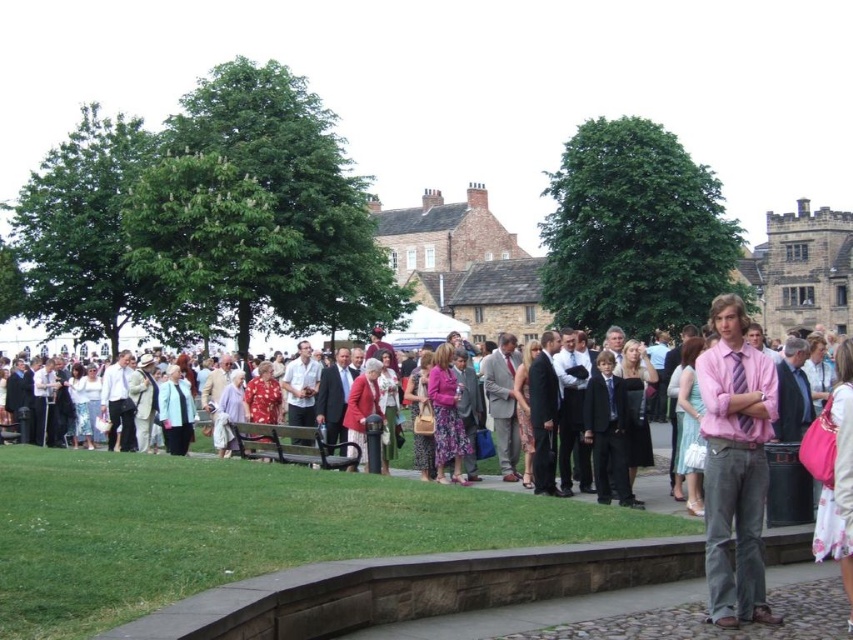
Which is behind, point (393, 584) or point (315, 464)?

The point (315, 464) is behind.

Locate an element on the screen. Image resolution: width=853 pixels, height=640 pixels. pink silk shirt at center is located at coordinates (415, 588).

Locate an element on the screen. The image size is (853, 640). pink silk shirt at center is located at coordinates (415, 588).

Who is more distant from viewer, [715,467] or [337,448]?

Point [337,448]

Can you confirm if pink satin shirt at right is smaller than black metal bench at center?

Actually, pink satin shirt at right might be larger than black metal bench at center.

Between point (746, 458) and point (338, 456), which one is positioned behind?

Point (338, 456)

Locate an element on the screen. The height and width of the screenshot is (640, 853). pink satin shirt at right is located at coordinates pos(735,465).

Is point (277, 612) positioned in front of point (743, 381)?

That is True.

Looking at this image, is pink silk shirt at center taller than pink satin shirt at right?

No.

At what (x,y) coordinates should I click in order to perform the action: click on pink silk shirt at center. Please return your answer as a coordinate pair (x, y). The width and height of the screenshot is (853, 640). Looking at the image, I should click on (415, 588).

At what (x,y) coordinates should I click in order to perform the action: click on pink silk shirt at center. Please return your answer as a coordinate pair (x, y). This screenshot has width=853, height=640. Looking at the image, I should click on (415, 588).